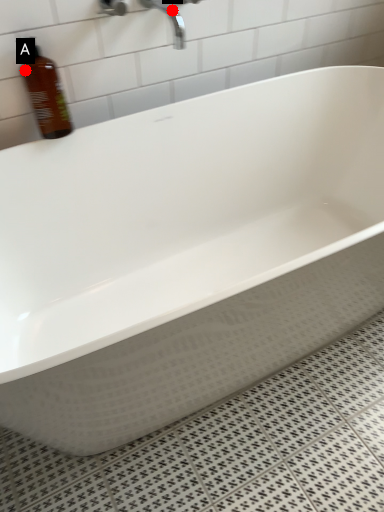
Question: Two points are circled on the image, labeled by A and B beside each circle. Which point is closer to the camera?

Choices:
 (A) A is closer
 (B) B is closer

Answer: (A)